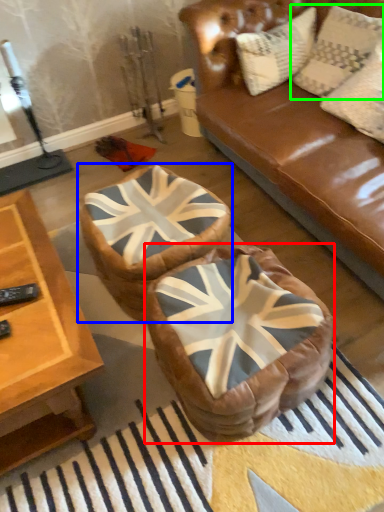
Question: Which is nearer to the bean bag chair (highlighted by a red box)? bean bag chair (highlighted by a blue box) or pillow (highlighted by a green box).

Choices:
 (A) bean bag chair
 (B) pillow

Answer: (A)